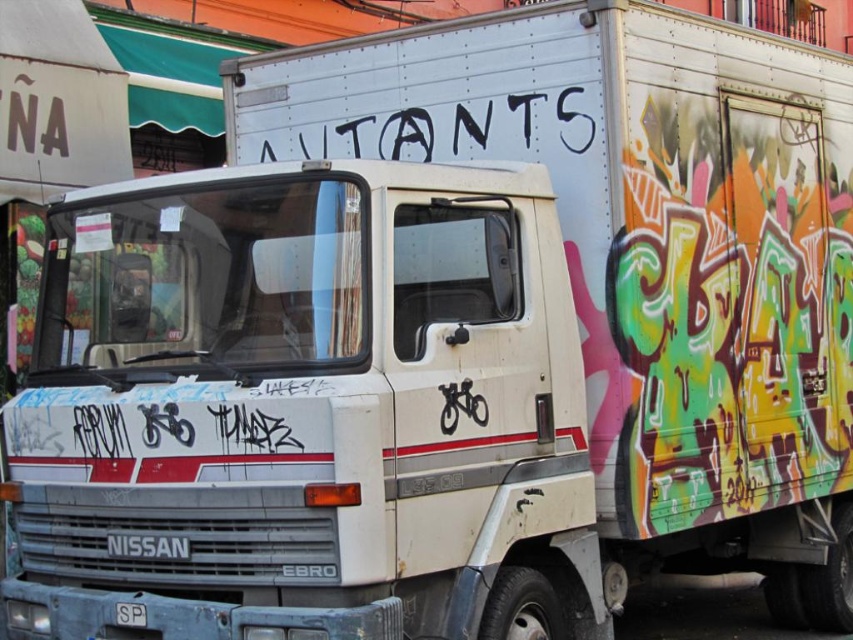
Question: Which point is farther to the camera?

Choices:
 (A) black paint graffiti at upper center
 (B) white plastic license plate at center

Answer: (A)

Question: Is black paint graffiti at upper center wider than white plastic license plate at center?

Choices:
 (A) yes
 (B) no

Answer: (A)

Question: Where is black paint graffiti at upper center located in relation to white plastic license plate at center in the image?

Choices:
 (A) above
 (B) below

Answer: (A)

Question: From the image, what is the correct spatial relationship of black paint graffiti at upper center in relation to white plastic license plate at center?

Choices:
 (A) above
 (B) below

Answer: (A)

Question: Which object is farther from the camera taking this photo?

Choices:
 (A) black paint graffiti at upper center
 (B) white plastic license plate at center

Answer: (A)